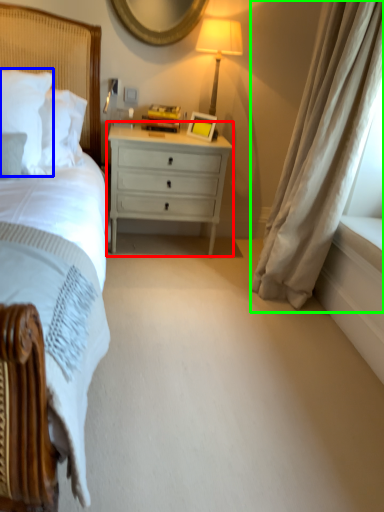
Question: Which object is the farthest from nightstand (highlighted by a red box)? Choose among these: pillow (highlighted by a blue box) or curtain (highlighted by a green box).

Choices:
 (A) pillow
 (B) curtain

Answer: (A)